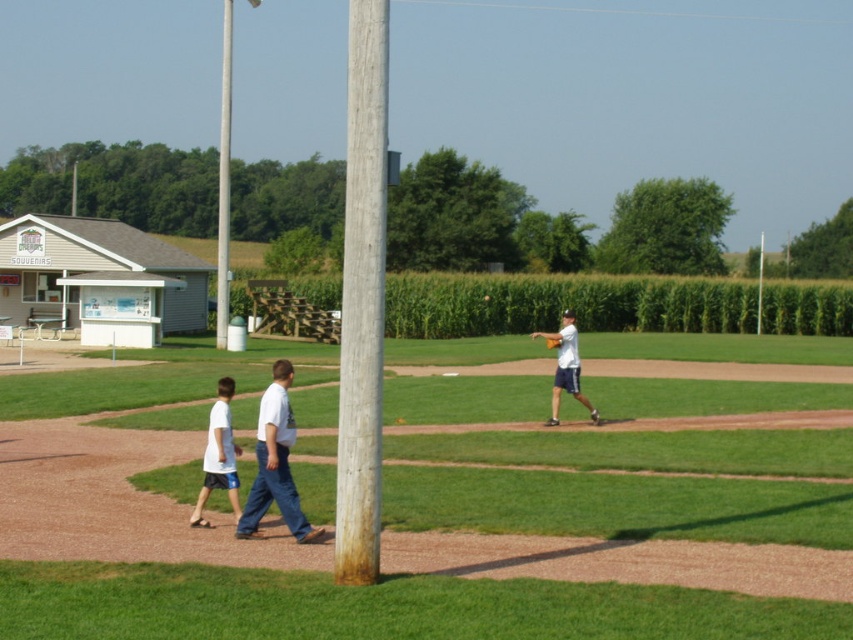
Question: Considering the relative positions of rusty wood pole at center and smooth gray pole at center in the image provided, where is rusty wood pole at center located with respect to smooth gray pole at center?

Choices:
 (A) right
 (B) left

Answer: (A)

Question: Does white wooden building at left come behind white cotton shirt at center?

Choices:
 (A) yes
 (B) no

Answer: (A)

Question: Estimate the real-world distances between objects in this image. Which object is closer to the brown leather glove at center?

Choices:
 (A) white wood pole at center
 (B) smooth gray pole at center

Answer: (B)

Question: Among these objects, which one is farthest from the camera?

Choices:
 (A) brown leather glove at center
 (B) white cotton shirt at lower left
 (C) white cotton shirt at center

Answer: (A)

Question: Which of the following is the closest to the observer?

Choices:
 (A) smooth gray pole at center
 (B) white cotton shirt at center
 (C) rusty wood pole at center
 (D) green grass field at center

Answer: (D)

Question: Does white cotton shirt at lower left have a lesser width compared to white matte baseball glove at center?

Choices:
 (A) no
 (B) yes

Answer: (B)